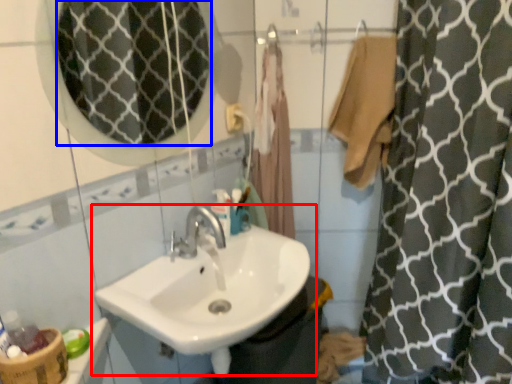
Question: Which object is further to the camera taking this photo, sink (highlighted by a red box) or mirror (highlighted by a blue box)?

Choices:
 (A) sink
 (B) mirror

Answer: (A)